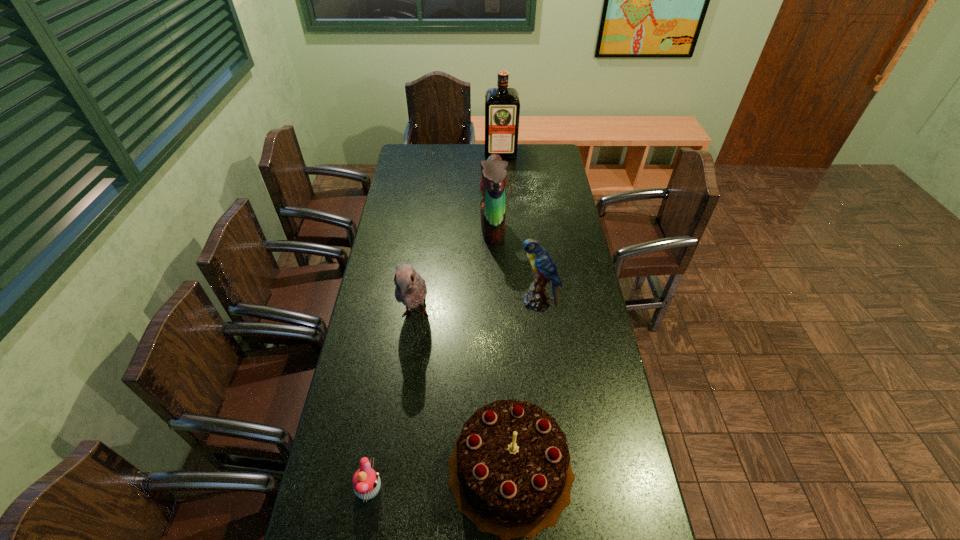
At what (x,y) coordinates should I click in order to perform the action: click on empty space between the second parrot from right to left and the leftmost parrot. Please return your answer as a coordinate pair (x, y). The height and width of the screenshot is (540, 960). Looking at the image, I should click on (454, 272).

Select which object is the fifth closest to the cupcake. Please provide its 2D coordinates. Your answer should be formatted as a tuple, i.e. [(x, y)], where the tuple contains the x and y coordinates of a point satisfying the conditions above.

[(502, 105)]

Identify the location of the closest object to the leftmost parrot. The image size is (960, 540). tap(510, 473).

What are the coordinates of `parrot that is the second nearest to the leftmost parrot` in the screenshot? It's located at (536, 299).

At what (x,y) coordinates should I click in order to perform the action: click on parrot that is the third closest to the liquor. Please return your answer as a coordinate pair (x, y). The width and height of the screenshot is (960, 540). Looking at the image, I should click on (411, 290).

The height and width of the screenshot is (540, 960). What are the coordinates of `blank area in the image that satisfies the following two spatial constraints: 1. at the face of the farthest parrot; 2. on the front-facing side of the leftmost parrot` in the screenshot? It's located at (495, 315).

Locate an element on the screen. The width and height of the screenshot is (960, 540). free space that satisfies the following two spatial constraints: 1. on the front-facing side of the leftmost parrot; 2. on the face of the cupcake is located at coordinates (393, 489).

You are a GUI agent. You are given a task and a screenshot of the screen. Output one action in this format:
    pyautogui.click(x=<x>, y=<y>)
    Task: Click on the free space that satisfies the following two spatial constraints: 1. on the front label of the farthest object; 2. on the face of the cupcake
    The image size is (960, 540).
    Given the screenshot: What is the action you would take?
    pyautogui.click(x=521, y=489)